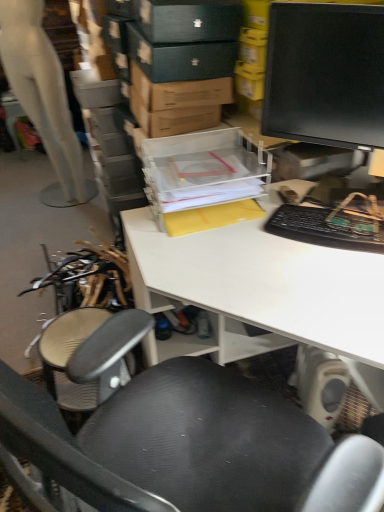
Find the location of `free space above white matte desk at center (from a real-world perspective)`. free space above white matte desk at center (from a real-world perspective) is located at coordinates (285, 257).